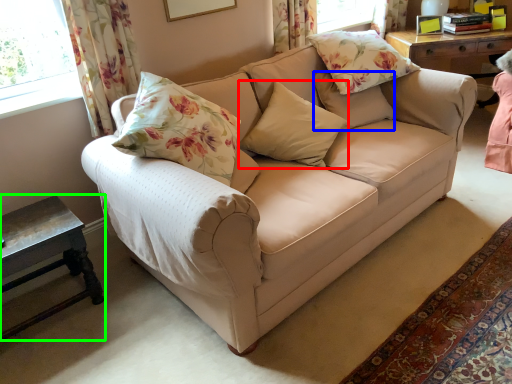
Question: Considering the real-world distances, which object is farthest from pillow (highlighted by a red box)? pillow (highlighted by a blue box) or table (highlighted by a green box)?

Choices:
 (A) pillow
 (B) table

Answer: (B)